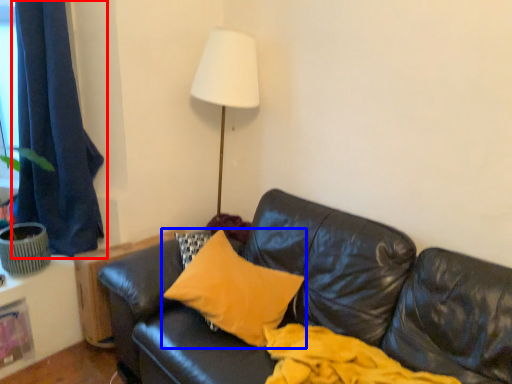
Question: Which of the following is the farthest to the observer, curtain (highlighted by a red box) or pillow (highlighted by a blue box)?

Choices:
 (A) curtain
 (B) pillow

Answer: (A)